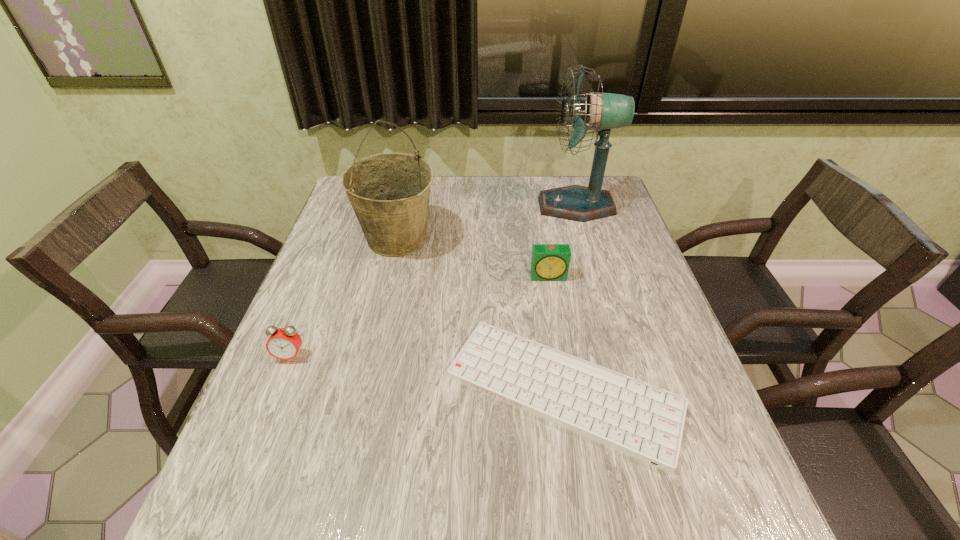
What are the coordinates of `vacant space positioned in front of the tallest object where the wind blows` in the screenshot? It's located at tap(461, 206).

Locate an element on the screen. The image size is (960, 540). vacant space located 0.110m on the back of the fourth object from right to left is located at coordinates (407, 196).

Locate an element on the screen. The height and width of the screenshot is (540, 960). free location located 0.060m on the front-facing side of the farther alarm clock is located at coordinates (553, 298).

This screenshot has width=960, height=540. Find the location of `vacant space located 0.160m on the front-facing side of the nearer alarm clock`. vacant space located 0.160m on the front-facing side of the nearer alarm clock is located at coordinates (259, 433).

Find the location of a particular element. This screenshot has width=960, height=540. vacant area located on the back of the shortest object is located at coordinates (548, 298).

Find the location of `fan that is at the far edge`. fan that is at the far edge is located at coordinates (603, 111).

At what (x,y) coordinates should I click in order to perform the action: click on wine bucket situated at the far edge. Please return your answer as a coordinate pair (x, y). The image size is (960, 540). Looking at the image, I should click on (389, 192).

The image size is (960, 540). Find the location of `wine bucket situated at the left edge`. wine bucket situated at the left edge is located at coordinates (389, 192).

You are a GUI agent. You are given a task and a screenshot of the screen. Output one action in this format:
    pyautogui.click(x=<x>, y=<y>)
    Task: Click on the alarm clock situated at the left edge
    This screenshot has height=540, width=960.
    Given the screenshot: What is the action you would take?
    pyautogui.click(x=284, y=343)

Where is `fan located in the right edge section of the desktop`? Image resolution: width=960 pixels, height=540 pixels. fan located in the right edge section of the desktop is located at coordinates (603, 111).